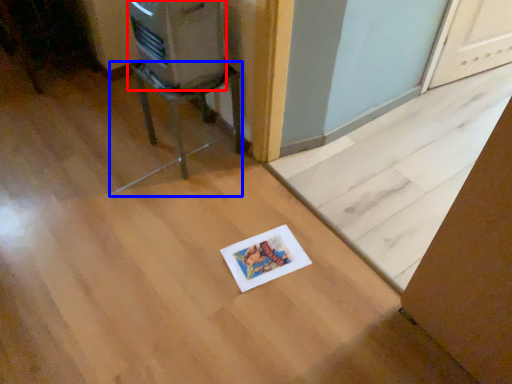
Question: Which of the following is the closest to the observer, appliance (highlighted by a red box) or furniture (highlighted by a blue box)?

Choices:
 (A) appliance
 (B) furniture

Answer: (A)